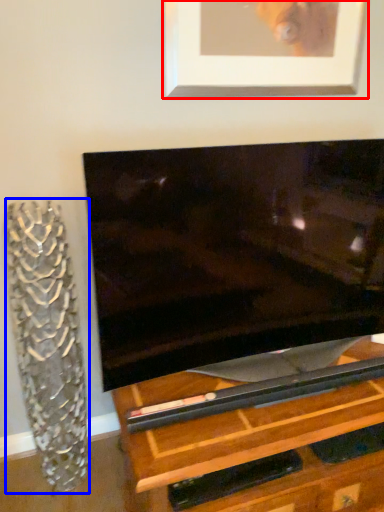
Question: Which point is further to the camera, picture frame (highlighted by a red box) or glass vase (highlighted by a blue box)?

Choices:
 (A) picture frame
 (B) glass vase

Answer: (A)